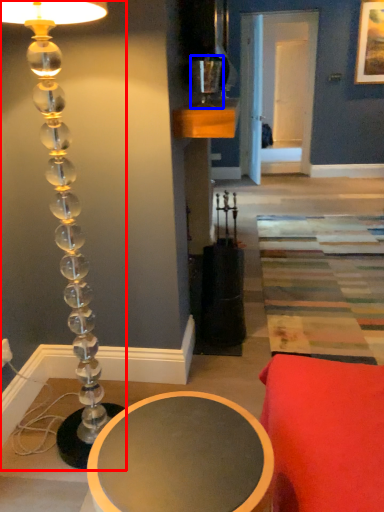
Question: Among these objects, which one is nearest to the camera, lamp (highlighted by a red box) or candle holder (highlighted by a blue box)?

Choices:
 (A) lamp
 (B) candle holder

Answer: (A)